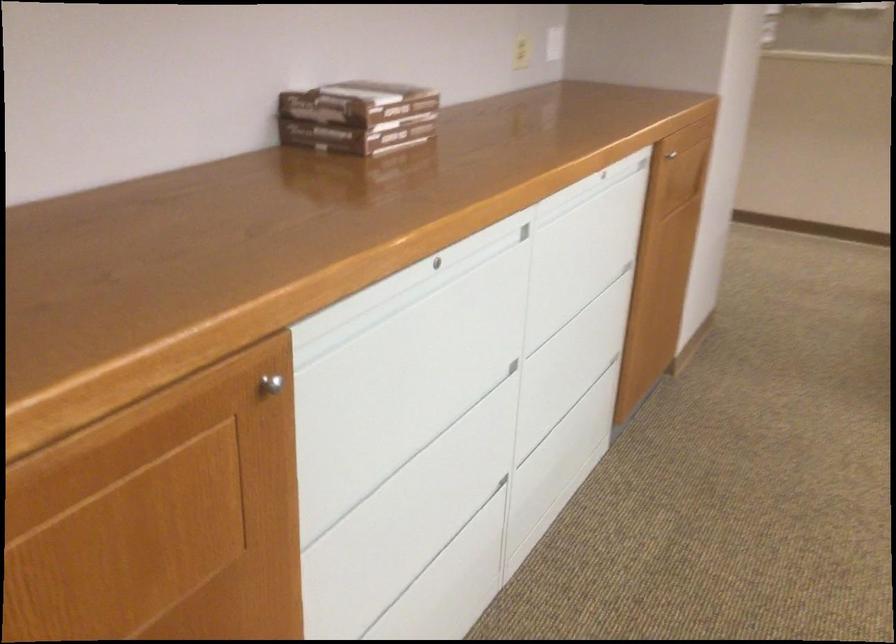
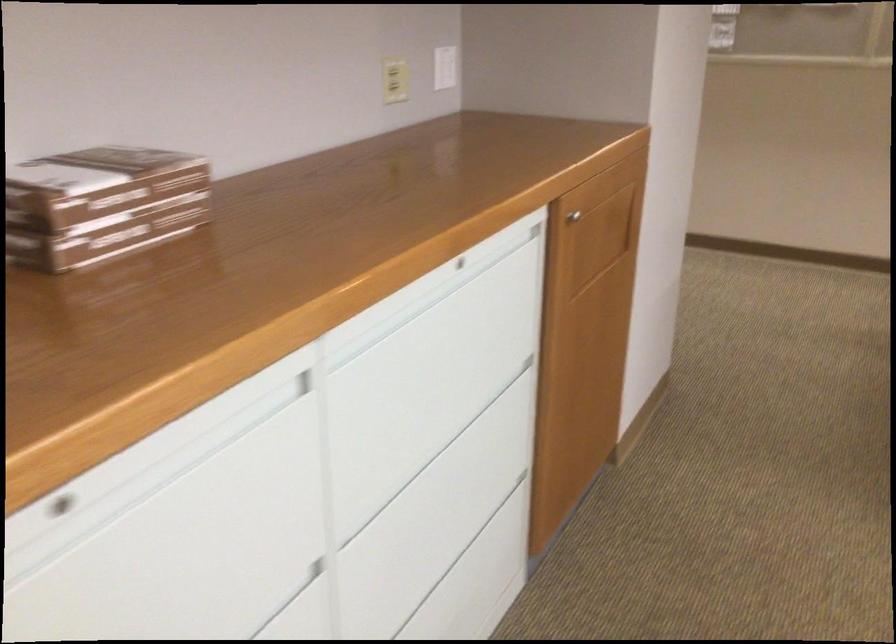
Question: The first image is from the beginning of the video and the second image is from the end. How did the camera likely rotate when shooting the video?

Choices:
 (A) Left
 (B) Right
 (C) Up
 (D) Down

Answer: (C)